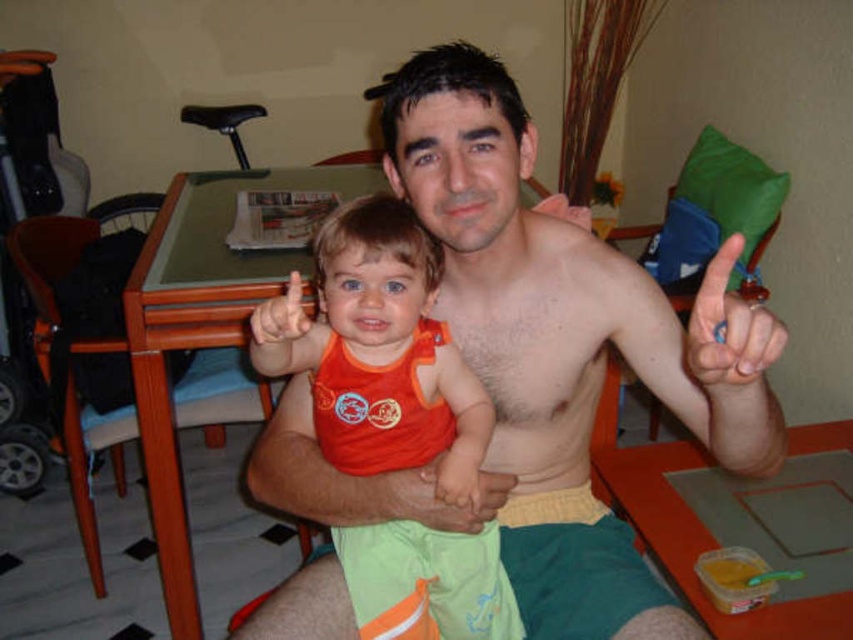
Question: Is the position of blue rubber band at upper center less distant than that of yellow/yellowish-green fabric at lower center?

Choices:
 (A) no
 (B) yes

Answer: (B)

Question: Which of these objects is positioned farthest from the blue rubber band at upper center?

Choices:
 (A) yellow/yellowish-green fabric at lower center
 (B) orange fabric toddler at center
 (C) shiny orange tank top at center

Answer: (B)

Question: Can you confirm if blue rubber band at upper center is positioned above yellow/yellowish-green fabric at lower center?

Choices:
 (A) no
 (B) yes

Answer: (B)

Question: Estimate the real-world distances between objects in this image. Which object is farther from the yellow/yellowish-green fabric at lower center?

Choices:
 (A) orange fabric toddler at center
 (B) shiny orange tank top at center

Answer: (B)

Question: Based on their relative distances, which object is farther from the blue rubber band at upper center?

Choices:
 (A) shiny orange tank top at center
 (B) orange fabric toddler at center

Answer: (B)

Question: Can you confirm if shiny orange tank top at center is wider than yellow/yellowish-green fabric at lower center?

Choices:
 (A) yes
 (B) no

Answer: (A)